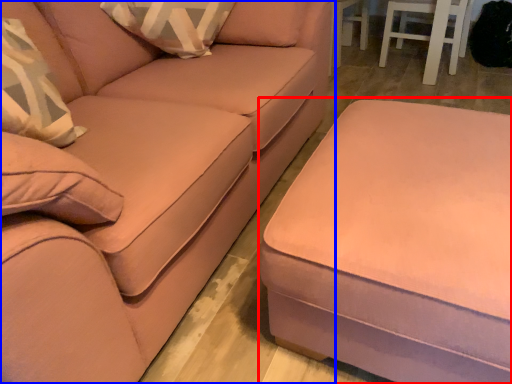
Question: Among these objects, which one is nearest to the camera, table (highlighted by a red box) or studio couch (highlighted by a blue box)?

Choices:
 (A) table
 (B) studio couch

Answer: (B)